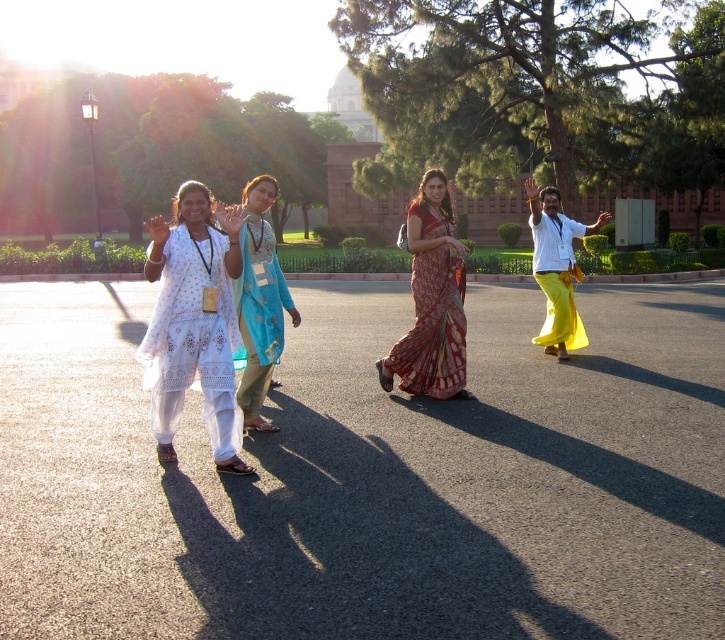
You are standing at the point closest to the camera in this scene. Which of the two points, point (430,330) or point (568,266), is the one you are currently at?

You are at point (430,330) because it is in front of point (568,266), so it is closer to the camera.

You are standing at the entrance of the park and see the printed silk saree at center and the yellow cotton saree at right. Which saree is closer to you?

The printed silk saree at center is closer to you because it is in front of the yellow cotton saree at right.